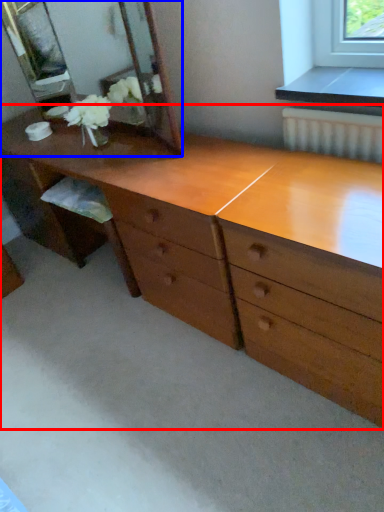
Question: Among these objects, which one is farthest to the camera, chest of drawers (highlighted by a red box) or mirror (highlighted by a blue box)?

Choices:
 (A) chest of drawers
 (B) mirror

Answer: (B)